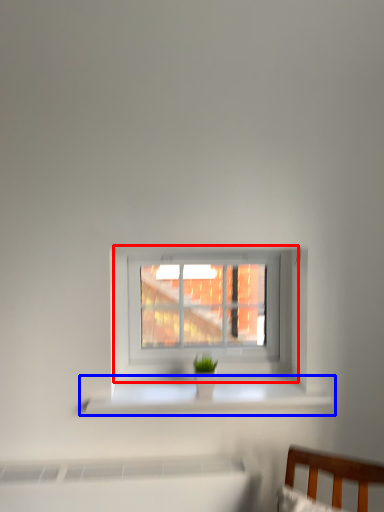
Question: Which point is further to the camera, window (highlighted by a red box) or window sill (highlighted by a blue box)?

Choices:
 (A) window
 (B) window sill

Answer: (A)